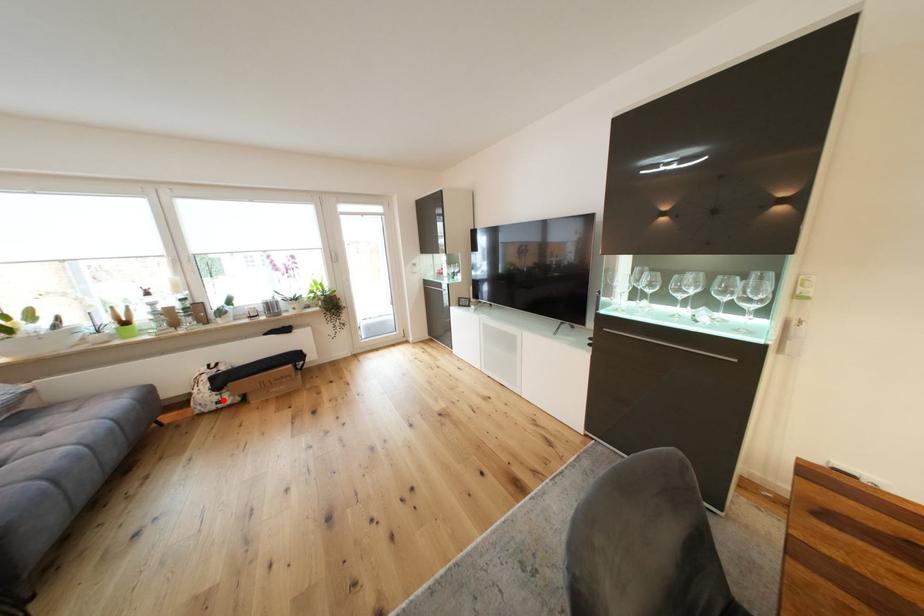
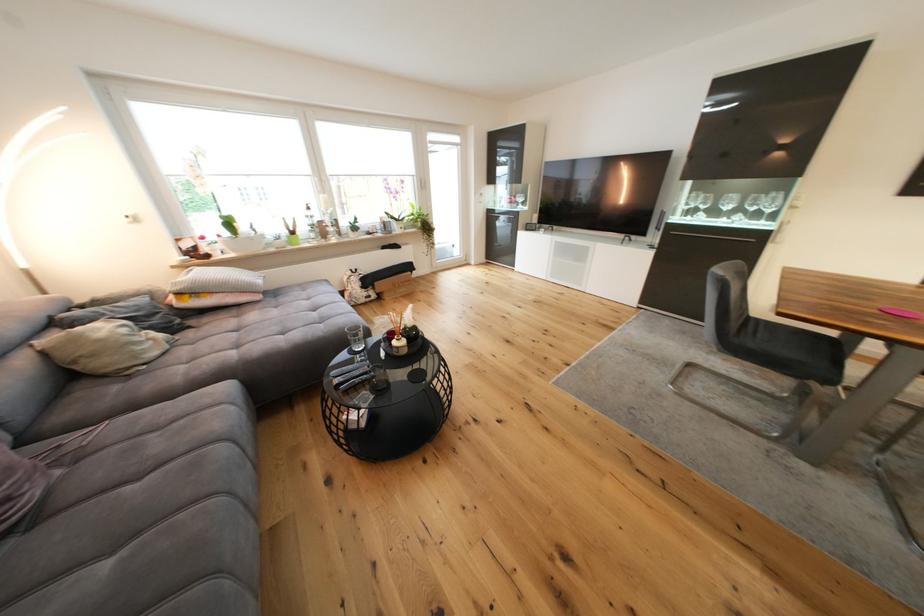
Question: I am providing you with two images of the same scene from different viewpoints. A red point is marked on the first image. Can you still see the location of the red point in image 2?

Choices:
 (A) Yes
 (B) No

Answer: (A)